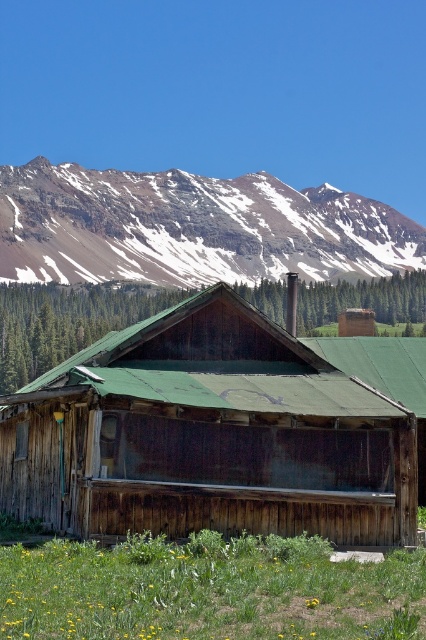
You are planning to take a photo of the snowy rocky mountain at upper center from the rusty wood log cabin at center. Will the cabin block your view of the mountain?

The rusty wood log cabin at center is located below the snowy rocky mountain at upper center, so the cabin will not block your view of the mountain.

You are standing in front of the rustic wooden cabin in the mountain landscape. There is a point marked at coordinates (x=209, y=435). Can you tell me what this point is located on?

The point at coordinates (x=209, y=435) is located on the rusty wood log cabin at center.